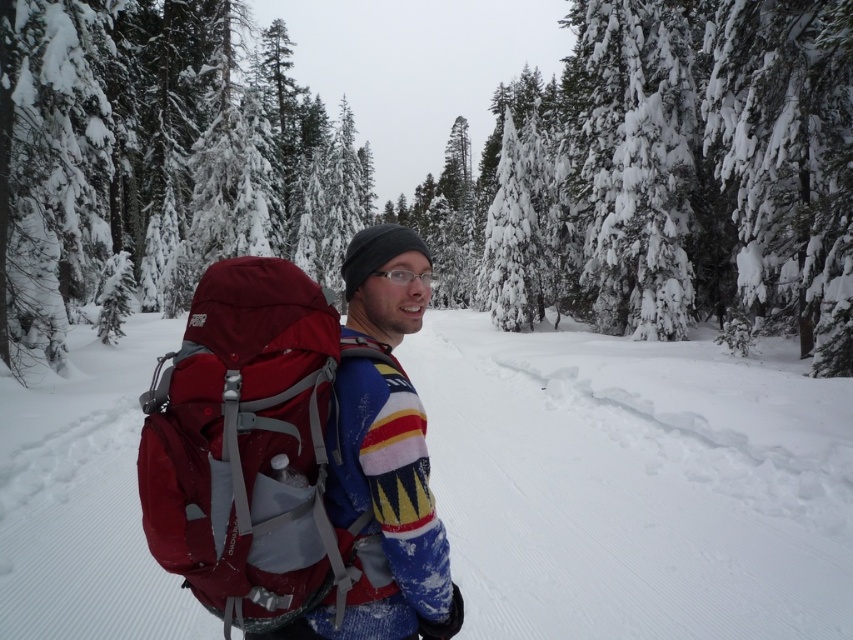
Who is higher up, white fluffy snow at center or clear plastic glasses at center?

clear plastic glasses at center is above.

Can you confirm if white fluffy snow at center is positioned to the left of clear plastic glasses at center?

Indeed, white fluffy snow at center is positioned on the left side of clear plastic glasses at center.

You are a GUI agent. You are given a task and a screenshot of the screen. Output one action in this format:
    pyautogui.click(x=<x>, y=<y>)
    Task: Click on the white fluffy snow at center
    
    Given the screenshot: What is the action you would take?
    pyautogui.click(x=636, y=483)

Where is `snowy evergreen tree at center`? snowy evergreen tree at center is located at coordinates (444, 170).

Is the position of snowy evergreen tree at center more distant than that of knitted wool sweater at center?

Yes, snowy evergreen tree at center is further from the viewer.

You are a GUI agent. You are given a task and a screenshot of the screen. Output one action in this format:
    pyautogui.click(x=<x>, y=<y>)
    Task: Click on the snowy evergreen tree at center
    
    Given the screenshot: What is the action you would take?
    pyautogui.click(x=444, y=170)

Does point (541, 509) come in front of point (448, 582)?

No, (541, 509) is behind (448, 582).

Can you confirm if white fluffy snow at center is shorter than knitted wool sweater at center?

No, white fluffy snow at center is not shorter than knitted wool sweater at center.

Find the location of `white fluffy snow at center`. white fluffy snow at center is located at coordinates (636, 483).